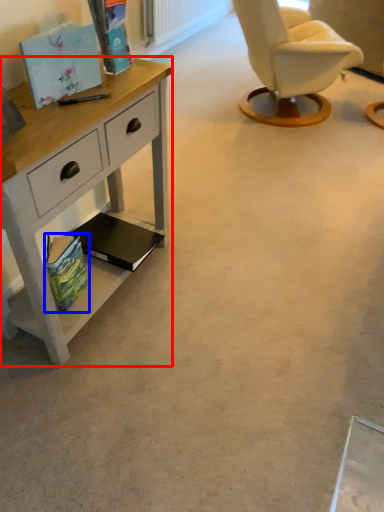
Question: Which object appears farthest to the camera in this image, desk (highlighted by a red box) or magazine (highlighted by a blue box)?

Choices:
 (A) desk
 (B) magazine

Answer: (B)